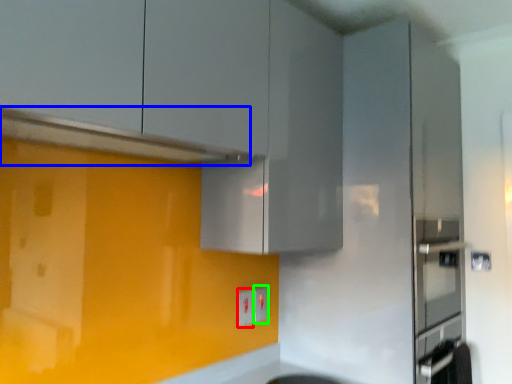
Question: Which object is the closest to the electric outlet (highlighted by a red box)? Choose among these: exhaust hood (highlighted by a blue box) or electric outlet (highlighted by a green box).

Choices:
 (A) exhaust hood
 (B) electric outlet

Answer: (B)